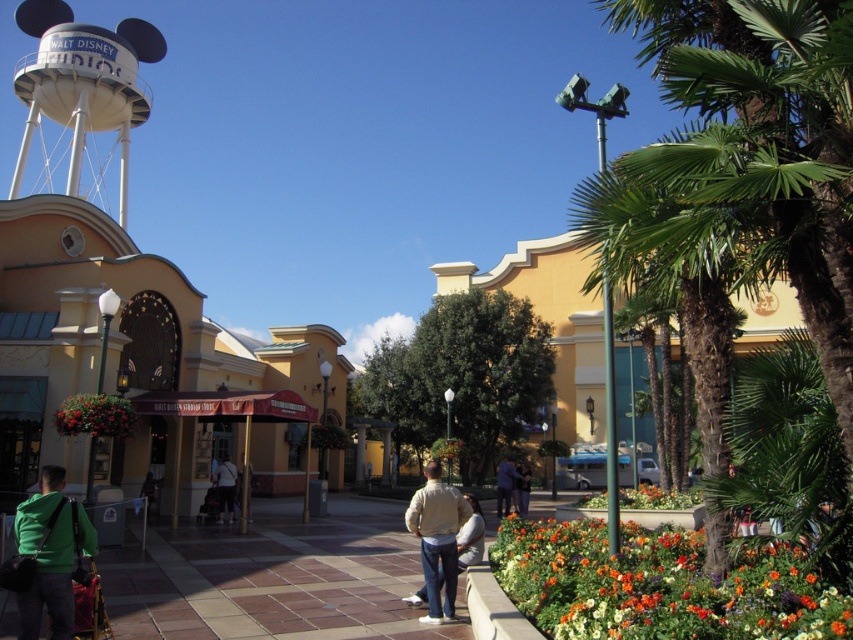
What do you see at coordinates (436, 541) in the screenshot? This screenshot has width=853, height=640. I see `light beige sweater at center` at bounding box center [436, 541].

Does light beige sweater at center have a greater height compared to dark blue shirt at center?

No, light beige sweater at center is not taller than dark blue shirt at center.

Is point (416, 529) positioned behind point (496, 502)?

No, (416, 529) is in front of (496, 502).

You are a GUI agent. You are given a task and a screenshot of the screen. Output one action in this format:
    pyautogui.click(x=<x>, y=<y>)
    Task: Click on the light beige sweater at center
    
    Given the screenshot: What is the action you would take?
    pyautogui.click(x=436, y=541)

Is green leafy palm tree at center right bigger than bright multicolored petals at lower right?

Indeed, green leafy palm tree at center right has a larger size compared to bright multicolored petals at lower right.

Can you confirm if green leafy palm tree at center right is positioned to the right of bright multicolored petals at lower right?

Correct, you'll find green leafy palm tree at center right to the right of bright multicolored petals at lower right.

The width and height of the screenshot is (853, 640). I want to click on green leafy palm tree at center right, so click(x=746, y=164).

Consider the image. Between green leafy palm tree at center right and vivid red flowers at center, which one appears on the right side from the viewer's perspective?

green leafy palm tree at center right

Can you confirm if green leafy palm tree at center right is bigger than vivid red flowers at center?

Correct, green leafy palm tree at center right is larger in size than vivid red flowers at center.

Is point (703, 241) farther from viewer compared to point (79, 417)?

No, (703, 241) is in front of (79, 417).

Locate an element on the screen. The image size is (853, 640). green leafy palm tree at center right is located at coordinates (746, 164).